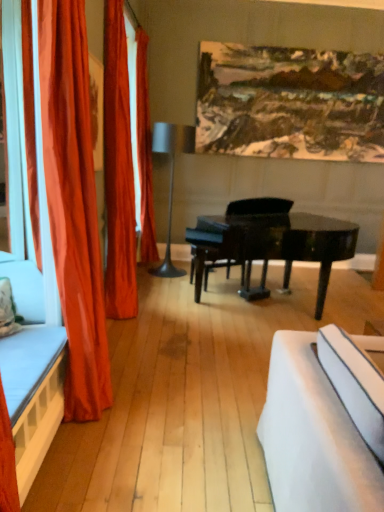
Question: In terms of width, does wooden bed frame at left look wider or thinner when compared to orange fabric curtain at left, the 3th curtain in the front-to-back sequence?

Choices:
 (A) thin
 (B) wide

Answer: (B)

Question: From the image's perspective, is wooden bed frame at left located above or below orange fabric curtain at left, the 3th curtain in the front-to-back sequence?

Choices:
 (A) above
 (B) below

Answer: (B)

Question: Which object is the closest to the velvet orange curtain at left, which ranks as the second curtain in front-to-back order?

Choices:
 (A) satin orange curtain at left, which ranks as the 1th curtain in front-to-back order
 (B) black glossy piano at center
 (C) orange fabric curtain at left, the 3th curtain in the front-to-back sequence
 (D) wooden bed frame at left
 (E) metallic gray floor lamp at center

Answer: (A)

Question: Estimate the real-world distances between objects in this image. Which object is closer to the velvet orange curtain at left, which appears as the 2th curtain when viewed from the back?

Choices:
 (A) metallic gray floor lamp at center
 (B) black glossy piano at center
 (C) satin orange curtain at left, which ranks as the 1th curtain in front-to-back order
 (D) orange fabric curtain at left, the 3th curtain in the front-to-back sequence
 (E) wooden bed frame at left

Answer: (C)